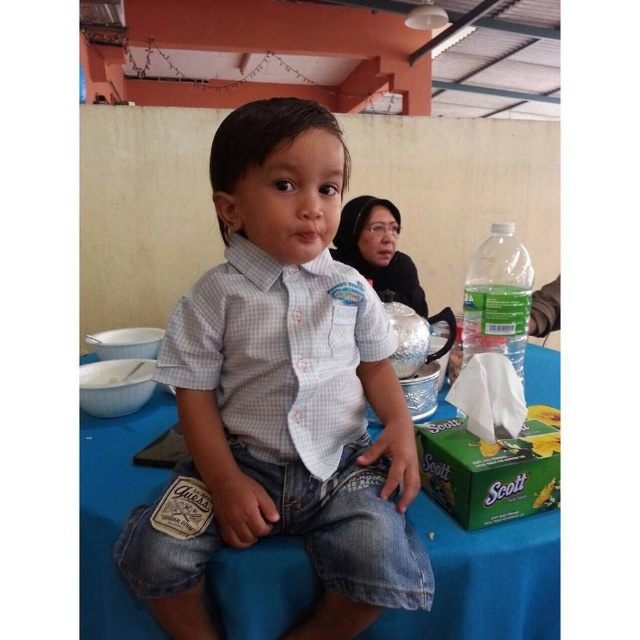
What are the coordinates of the light blue checkered shirt at center?

The coordinates of the light blue checkered shirt at center are at point (284,392).

You are a guest at a picnic and see the blue fabric table at center and the clear plastic bottle at right. Which object would you estimate is larger in size?

The blue fabric table at center is bigger than the clear plastic bottle at right, so the blue fabric table at center is larger in size.